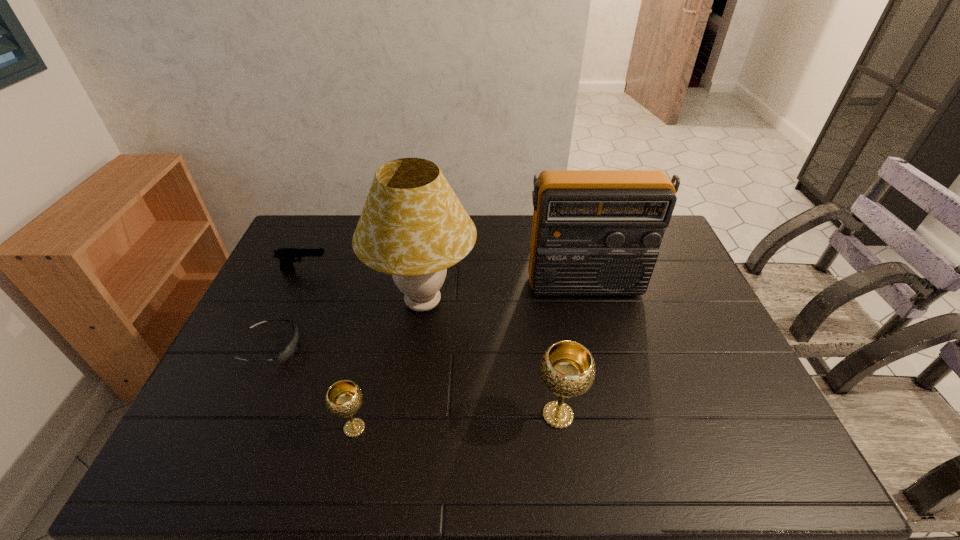
What are the coordinates of `free point that keeps the chalices evenly spaced on the right` in the screenshot? It's located at (752, 403).